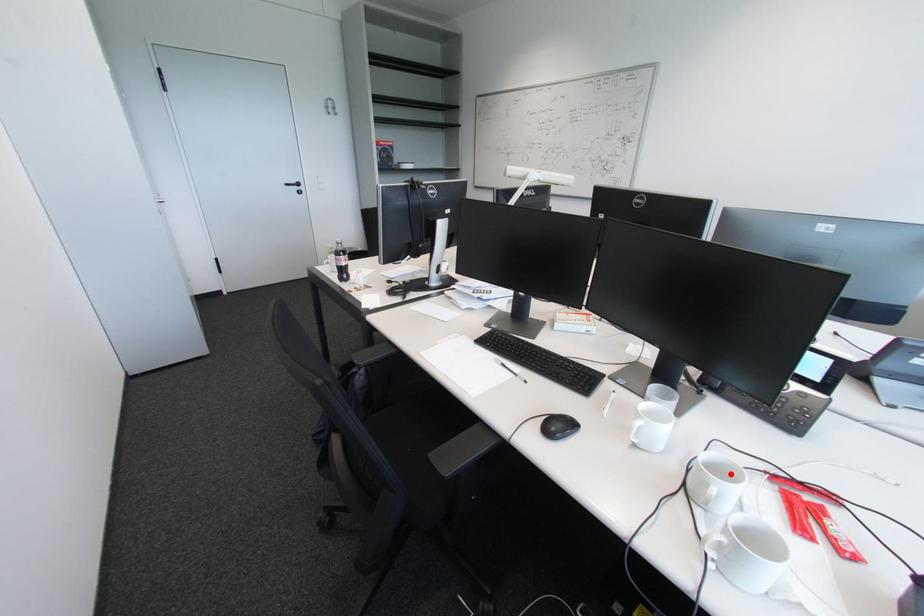
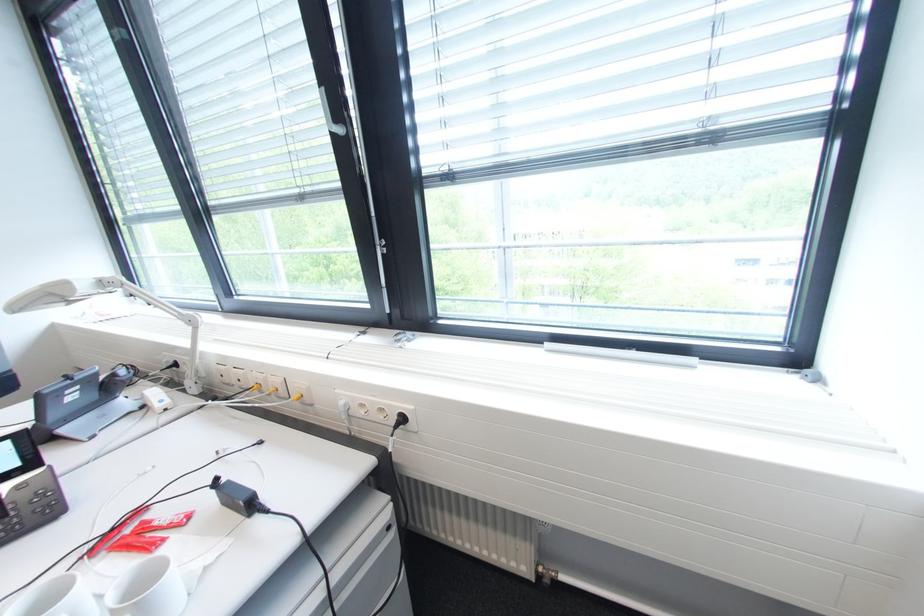
Question: I am providing you with two images of the same scene from different viewpoints. A red point is shown in image1. For the corresponding object point in image2, is it positioned nearer or farther from the camera?

Choices:
 (A) Nearer
 (B) Farther

Answer: (A)